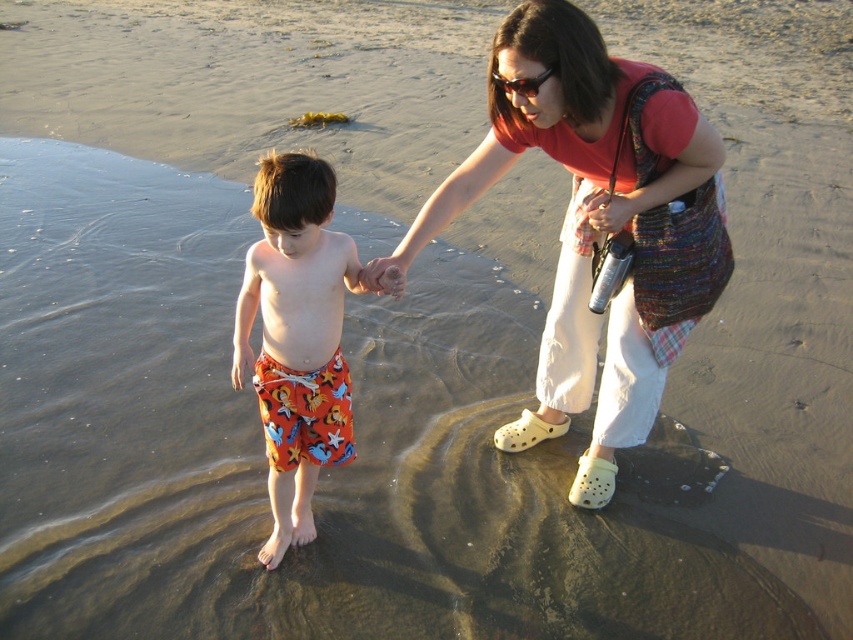
You are a photographer trying to capture a candid shot of the two people at the center of the beach scene. You need to ensure that both the matte red shirt at center and the printed swim trunks at center are clearly visible in the frame. Considering their sizes, which one might require more careful framing to avoid being overshadowed?

The printed swim trunks at center are smaller than the matte red shirt at center, so they might require more careful framing to avoid being overshadowed by the larger object.

You are a photographer trying to capture a candid shot of the two people in the center of the image. The camera you are using has a focus range that can only capture objects within a 1.2 meter vertical distance. Given that the matte red shirt at center is above the printed swim trunks at center, will your camera be able to capture both subjects in focus?

The matte red shirt at center is above the printed swim trunks at center, but without knowing the exact vertical distance between them, it is impossible to determine if the camera can capture both in focus within the 1.2 meter range.

Based on the scene description, where is the matte red shirt at center located in the image?

The matte red shirt at center is located at point 0.350 on the x axis and 0.700 on the y axis.